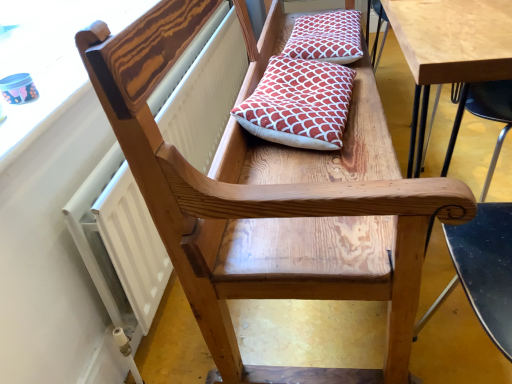
Question: Is red patterned cushion at upper center, the second pillow viewed from the front, shorter than red patterned cushion at center, arranged as the 1th pillow when viewed from the front?

Choices:
 (A) no
 (B) yes

Answer: (B)

Question: From a real-world perspective, is red patterned cushion at upper center, positioned as the 1th pillow in top-to-bottom order, on red patterned cushion at center, the second pillow from the top?

Choices:
 (A) no
 (B) yes

Answer: (A)

Question: From the image's perspective, does red patterned cushion at upper center, positioned as the 1th pillow in top-to-bottom order, appear lower than red patterned cushion at center, arranged as the 1th pillow when viewed from the front?

Choices:
 (A) yes
 (B) no

Answer: (B)

Question: From a real-world perspective, is red patterned cushion at upper center, positioned as the 1th pillow in top-to-bottom order, beneath red patterned cushion at center, the second pillow from the top?

Choices:
 (A) yes
 (B) no

Answer: (A)

Question: Is the depth of red patterned cushion at upper center, the 1th pillow when ordered from back to front, less than that of red patterned cushion at center, acting as the second pillow starting from the back?

Choices:
 (A) yes
 (B) no

Answer: (B)

Question: Are red patterned cushion at upper center, the 1th pillow when ordered from back to front, and red patterned cushion at center, the second pillow from the top, beside each other?

Choices:
 (A) yes
 (B) no

Answer: (B)

Question: Considering the relative sizes of wooden chair arm at upper left and red patterned cushion at upper center, the second pillow viewed from the front, in the image provided, is wooden chair arm at upper left taller than red patterned cushion at upper center, the second pillow viewed from the front,?

Choices:
 (A) no
 (B) yes

Answer: (A)

Question: Considering the relative positions of wooden chair arm at upper left and red patterned cushion at upper center, positioned as the 1th pillow in top-to-bottom order, in the image provided, is wooden chair arm at upper left to the right of red patterned cushion at upper center, positioned as the 1th pillow in top-to-bottom order, from the viewer's perspective?

Choices:
 (A) yes
 (B) no

Answer: (B)

Question: Considering the relative sizes of wooden chair arm at upper left and red patterned cushion at upper center, the second pillow viewed from the front, in the image provided, is wooden chair arm at upper left smaller than red patterned cushion at upper center, the second pillow viewed from the front,?

Choices:
 (A) no
 (B) yes

Answer: (A)

Question: Is wooden chair arm at upper left positioned far away from red patterned cushion at upper center, the 1th pillow when ordered from back to front?

Choices:
 (A) yes
 (B) no

Answer: (B)

Question: Can you confirm if wooden chair arm at upper left is bigger than red patterned cushion at upper center, the second pillow in the bottom-to-top sequence?

Choices:
 (A) no
 (B) yes

Answer: (B)

Question: Is wooden chair arm at upper left thinner than red patterned cushion at upper center, positioned as the 1th pillow in top-to-bottom order?

Choices:
 (A) yes
 (B) no

Answer: (A)

Question: Would you say red patterned cushion at center, the second pillow from the top, contains white textured radiator at upper left?

Choices:
 (A) yes
 (B) no

Answer: (B)